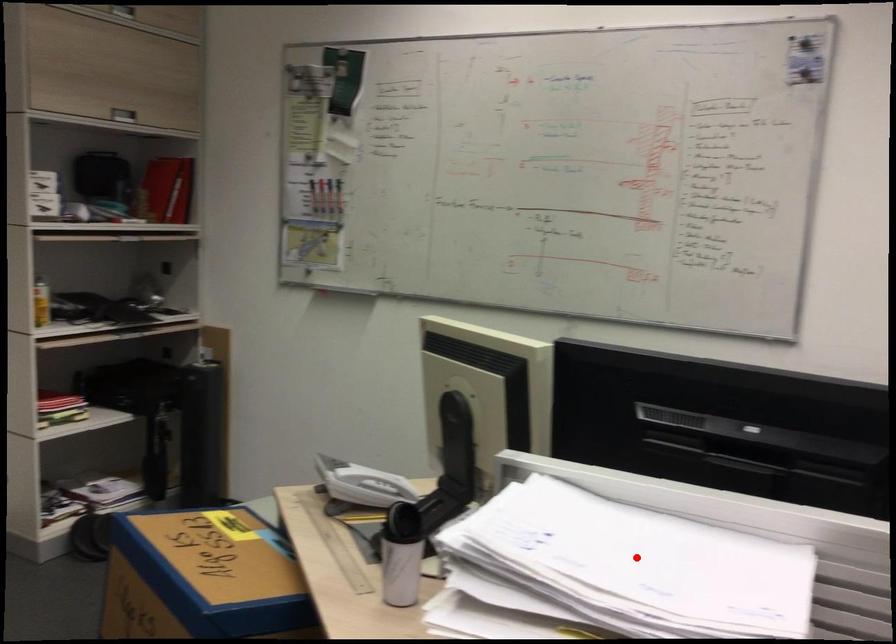
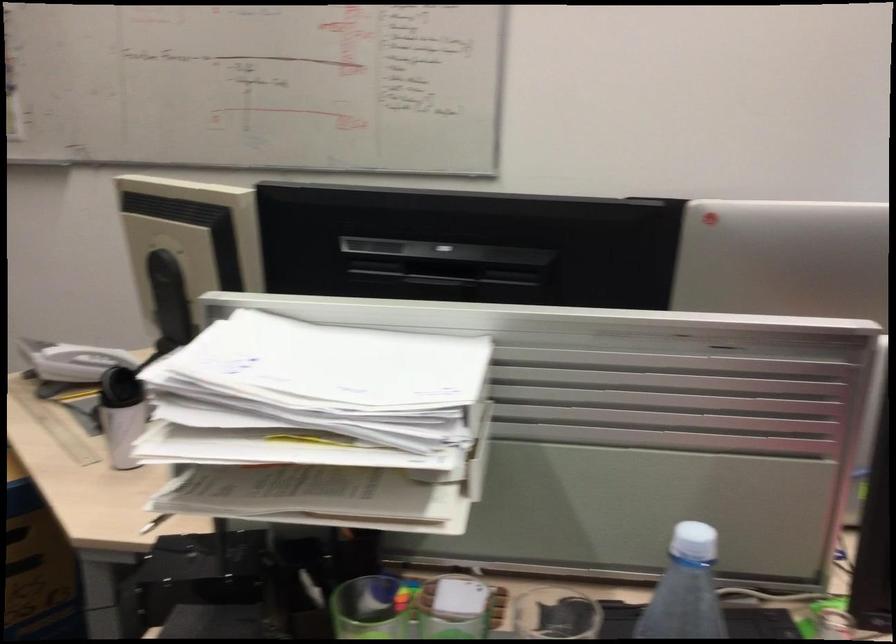
In the second image, find the point that corresponds to the highlighted location in the first image.

(333, 365)